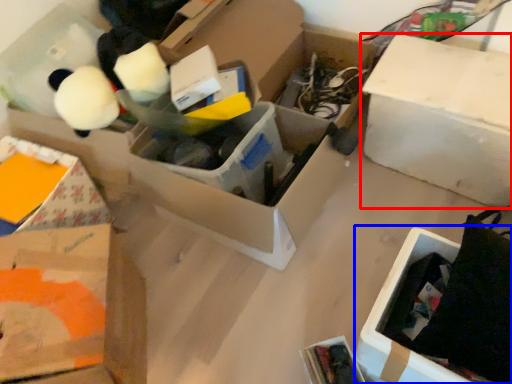
Question: Among these objects, which one is nearest to the camera, box (highlighted by a red box) or cardboard box (highlighted by a blue box)?

Choices:
 (A) box
 (B) cardboard box

Answer: (B)